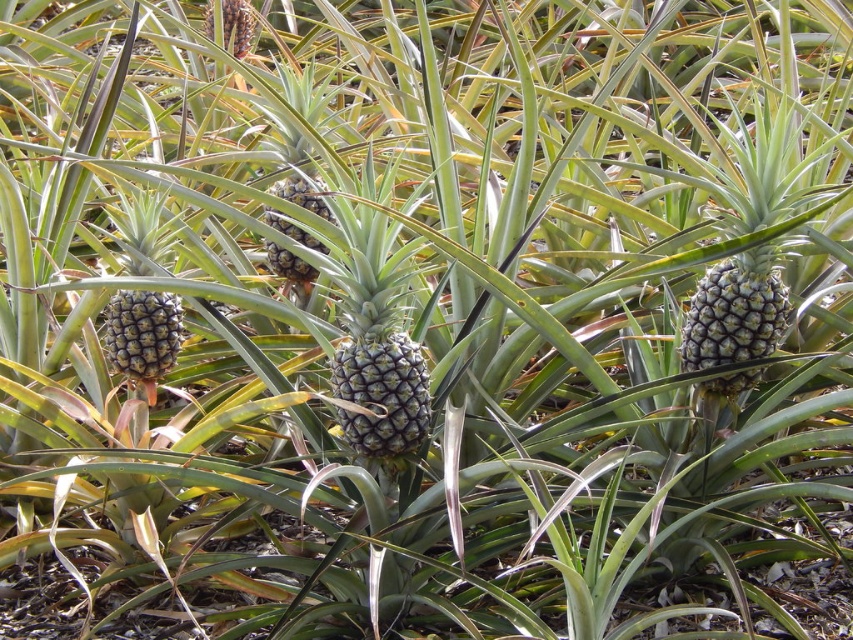
You are a farmer inspecting a pineapple plantation. You see a green textured pineapple at left. Where exactly is the pineapple located in the image?

The green textured pineapple at left is located at the 2D coordinates point (x=143, y=333) in the image.

You are a farmer checking the pineapple plantation. You notice the green textured pineapple at center and the spongy brown pineapple at upper center. Which pineapple is closer to you?

The green textured pineapple at center is closer to you because it is in front of the spongy brown pineapple at upper center.

You are a farmer checking pineapple sizes. You have a basket that can hold pineapples up to 10 cm wide. You see the green textured pineapple at center and the spongy brown pineapple at upper center. Which pineapple is more likely to fit in your basket?

The green textured pineapple at center has a lesser width compared to the spongy brown pineapple at upper center, so it is more likely to fit in the basket.